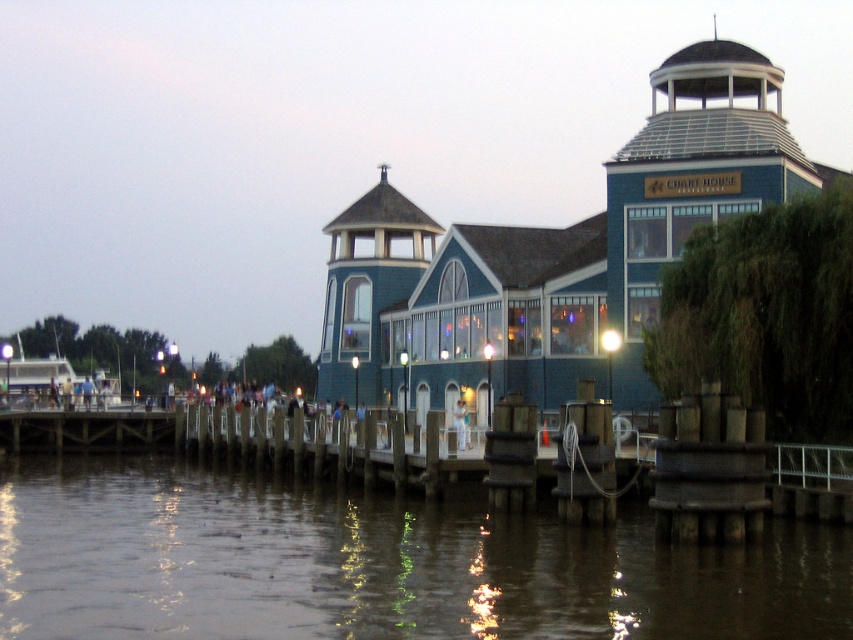
Is brown murky water at lower center bigger than white fabric dress at center?

Correct, brown murky water at lower center is larger in size than white fabric dress at center.

Is brown murky water at lower center above white fabric dress at center?

No.

Is point (706, 595) less distant than point (462, 403)?

Yes, it is.

This screenshot has height=640, width=853. I want to click on brown murky water at lower center, so pyautogui.click(x=375, y=564).

Which is below, brown murky water at lower center or white glossy boat at lower left?

brown murky water at lower center is lower down.

Who is taller, brown murky water at lower center or white glossy boat at lower left?

white glossy boat at lower left is taller.

Who is more forward, (x=395, y=552) or (x=27, y=378)?

Point (x=395, y=552)

What are the coordinates of `brown murky water at lower center` in the screenshot? It's located at (375, 564).

Measure the distance between white glossy boat at lower left and white fabric dress at center.

white glossy boat at lower left is 64.59 meters from white fabric dress at center.

The width and height of the screenshot is (853, 640). What do you see at coordinates (36, 378) in the screenshot? I see `white glossy boat at lower left` at bounding box center [36, 378].

This screenshot has height=640, width=853. What are the coordinates of `white glossy boat at lower left` in the screenshot? It's located at 36,378.